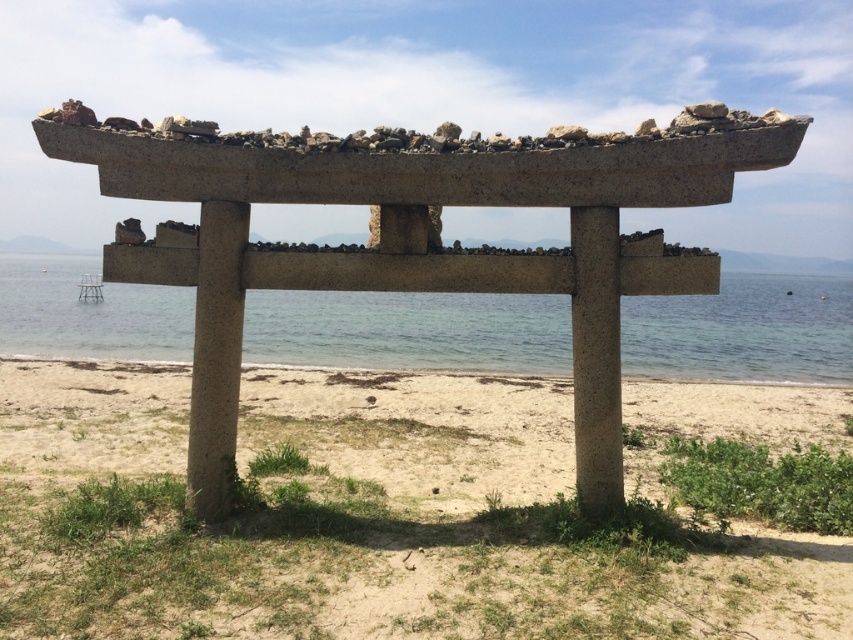
This screenshot has height=640, width=853. Describe the element at coordinates (357, 520) in the screenshot. I see `light brown sandy beach at center` at that location.

From the picture: Does light brown sandy beach at center have a lesser height compared to clear blue water at center?

Yes.

At what (x,y) coordinates should I click in order to perform the action: click on light brown sandy beach at center. Please return your answer as a coordinate pair (x, y). This screenshot has width=853, height=640. Looking at the image, I should click on (357, 520).

Where is `light brown sandy beach at center`? The image size is (853, 640). light brown sandy beach at center is located at coordinates (357, 520).